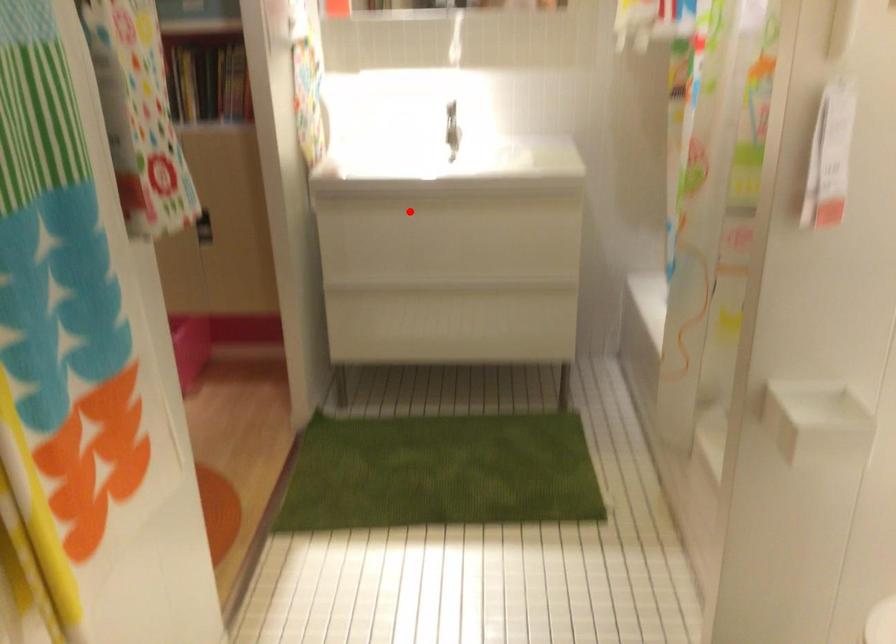
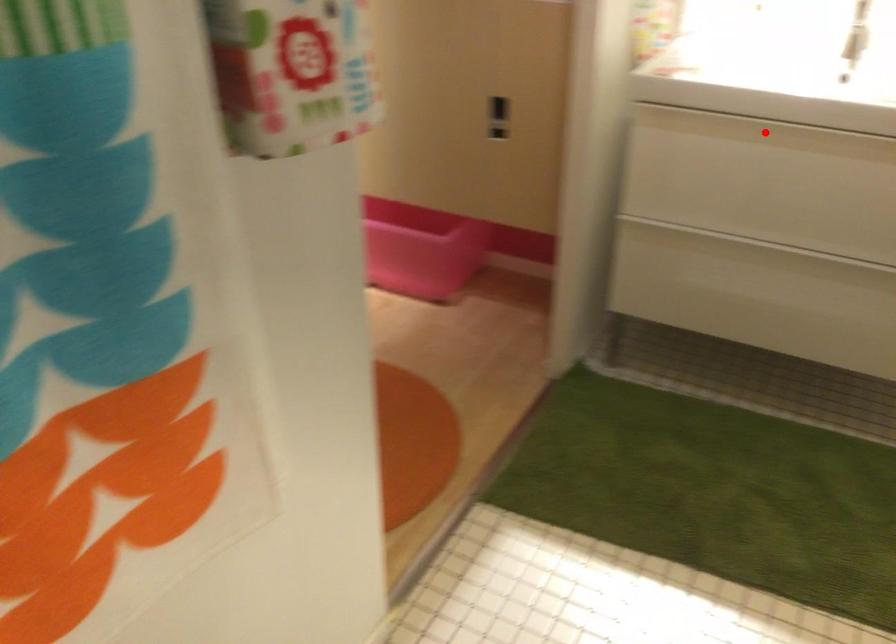
I am providing you with two images of the same scene from different viewpoints. A red point is marked on the first image and another point is marked on the second image. Is the red point in image1 aligned with the point shown in image2?

Yes